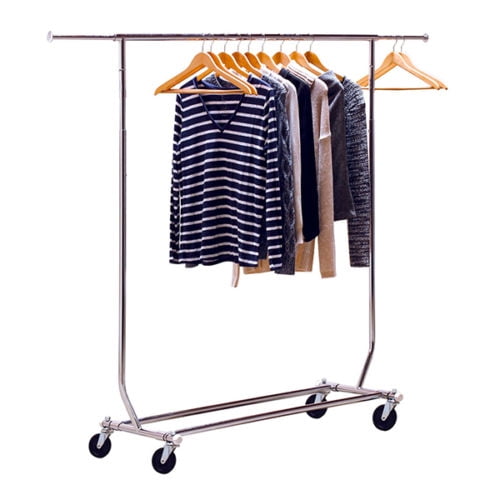
This screenshot has width=500, height=500. I want to click on empty hanger, so click(x=245, y=90), click(x=252, y=91), click(x=397, y=56), click(x=406, y=56).